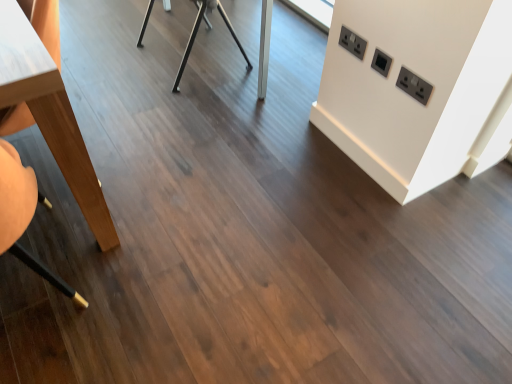
Where is `free space between metallic silver table at center, which is the 2th table from left to right, and wooden swivel chair at left`? The width and height of the screenshot is (512, 384). free space between metallic silver table at center, which is the 2th table from left to right, and wooden swivel chair at left is located at coordinates (158, 128).